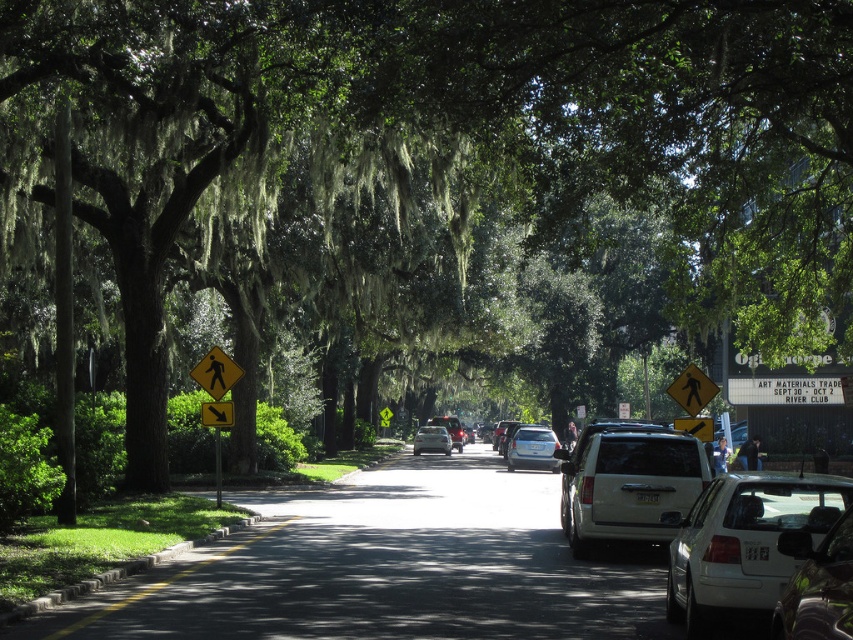
Is white matte suv at center bigger than yellow reflective pedestrian crossing sign at center?

Incorrect, white matte suv at center is not larger than yellow reflective pedestrian crossing sign at center.

Which is in front, point (650, 461) or point (701, 390)?

Positioned in front is point (650, 461).

What do you see at coordinates (628, 483) in the screenshot? This screenshot has height=640, width=853. I see `white matte suv at center` at bounding box center [628, 483].

At what (x,y) coordinates should I click in order to perform the action: click on white matte suv at center. Please return your answer as a coordinate pair (x, y). Image resolution: width=853 pixels, height=640 pixels. Looking at the image, I should click on (628, 483).

Is satin silver sedan at center wider than yellow painted curb at lower left?

Yes, satin silver sedan at center is wider than yellow painted curb at lower left.

Which is below, satin silver sedan at center or yellow painted curb at lower left?

satin silver sedan at center is below.

Which is in front, point (512, 436) or point (160, 582)?

Point (160, 582) is in front.

Where is `satin silver sedan at center`? satin silver sedan at center is located at coordinates (532, 449).

Can you confirm if silver metallic sedan at center is positioned above yellow plastic pedestrian crossing sign at center?

No.

Measure the distance between point (433, 426) and camera.

The distance of point (433, 426) from camera is 56.57 meters.

Find the location of a particular element. The image size is (853, 640). silver metallic sedan at center is located at coordinates (x=431, y=440).